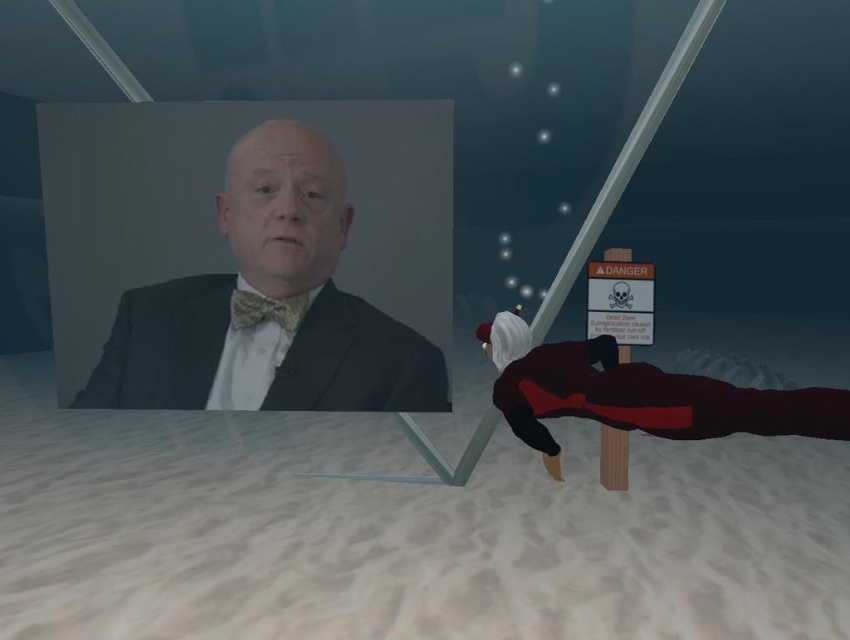
You are standing on the white sandy beach at lower center and want to place a small decorative item on the gold textured bow tie at center. Considering their sizes, will the item fit comfortably without overlapping the edges?

The white sandy beach at lower center is bigger than the gold textured bow tie at center. Since the bow tie is smaller, placing a small decorative item might not fit comfortably without overlapping the edges.